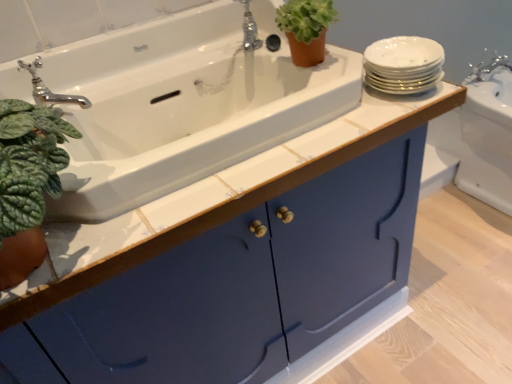
Question: In which direction should I rotate to look at polished chrome faucet at upper center, the first tap when ordered from back to front?

Choices:
 (A) left
 (B) right

Answer: (A)

Question: Considering the relative sizes of white porcelain plates at upper right and white glossy sink at upper right, the first sink from the back, in the image provided, is white porcelain plates at upper right smaller than white glossy sink at upper right, the first sink from the back,?

Choices:
 (A) no
 (B) yes

Answer: (B)

Question: Can you confirm if white porcelain plates at upper right is taller than white glossy sink at upper right, the first sink from the back?

Choices:
 (A) yes
 (B) no

Answer: (B)

Question: Is white glossy sink at upper right, which is the second sink from left to right, at the back of white porcelain plates at upper right?

Choices:
 (A) no
 (B) yes

Answer: (A)

Question: From a real-world perspective, is white porcelain plates at upper right over white glossy sink at upper right, placed as the 1th sink when sorted from right to left?

Choices:
 (A) yes
 (B) no

Answer: (A)

Question: Does white porcelain plates at upper right contain white glossy sink at upper right, the 2th sink from the front?

Choices:
 (A) no
 (B) yes

Answer: (A)

Question: From the image's perspective, is white porcelain plates at upper right below white glossy sink at upper right, the 2th sink from the front?

Choices:
 (A) yes
 (B) no

Answer: (B)

Question: From the image's perspective, is white ceramic sink at upper left, the 2th sink when ordered from right to left, located beneath chrome metallic faucet at upper left, positioned as the first tap in bottom-to-top order?

Choices:
 (A) yes
 (B) no

Answer: (A)

Question: Does white ceramic sink at upper left, which ranks as the first sink in left-to-right order, have a greater height compared to chrome metallic faucet at upper left, the 2th tap when ordered from back to front?

Choices:
 (A) yes
 (B) no

Answer: (A)

Question: Is white ceramic sink at upper left, the 2th sink when ordered from right to left, wider than chrome metallic faucet at upper left, marked as the second tap in a top-to-bottom arrangement?

Choices:
 (A) yes
 (B) no

Answer: (A)

Question: From a real-world perspective, does white ceramic sink at upper left, which is the first sink from front to back, sit lower than chrome metallic faucet at upper left, the 2th tap from the right?

Choices:
 (A) yes
 (B) no

Answer: (A)

Question: Are white ceramic sink at upper left, the 2th sink from the back, and chrome metallic faucet at upper left, the first tap in the front-to-back sequence, located far from each other?

Choices:
 (A) no
 (B) yes

Answer: (A)

Question: Does white ceramic sink at upper left, which ranks as the first sink in left-to-right order, have a lesser height compared to chrome metallic faucet at upper left, the 1th tap from the left?

Choices:
 (A) no
 (B) yes

Answer: (A)

Question: Could white porcelain plates at upper right be considered to be inside white glossy sink at upper right, placed as the 1th sink when sorted from right to left?

Choices:
 (A) yes
 (B) no

Answer: (B)